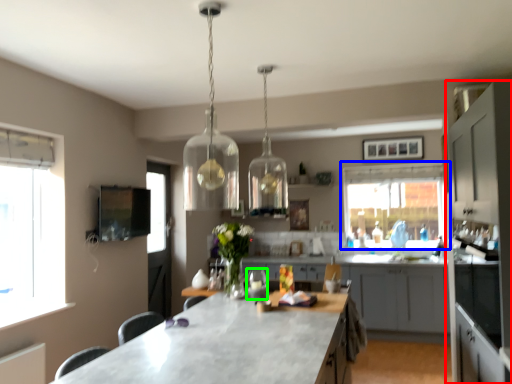
Question: Estimate the real-world distances between objects in this image. Which object is closer to cabinetry (highlighted by a red box), window (highlighted by a blue box) or wine glass (highlighted by a green box)?

Choices:
 (A) window
 (B) wine glass

Answer: (B)